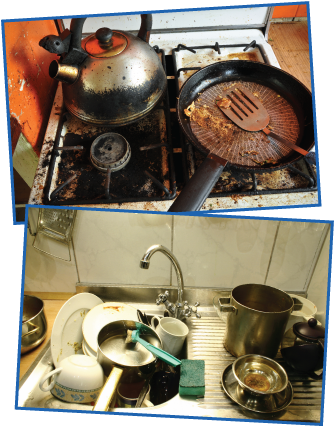
I want to click on grout on tile wall above sink, so click(172, 233).